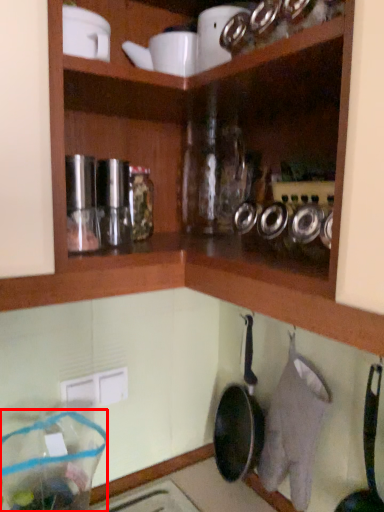
Question: From the image's perspective, considering the relative positions of glass jar (annotated by the red box) and frying pan in the image provided, where is glass jar (annotated by the red box) located with respect to the staircase?

Choices:
 (A) below
 (B) above

Answer: (A)